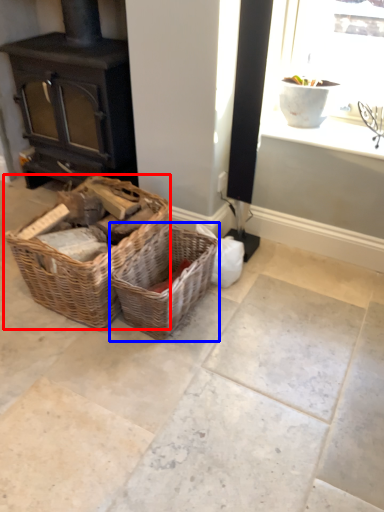
Question: Which object appears closest to the camera in this image, picnic basket (highlighted by a red box) or picnic basket (highlighted by a blue box)?

Choices:
 (A) picnic basket
 (B) picnic basket

Answer: (A)